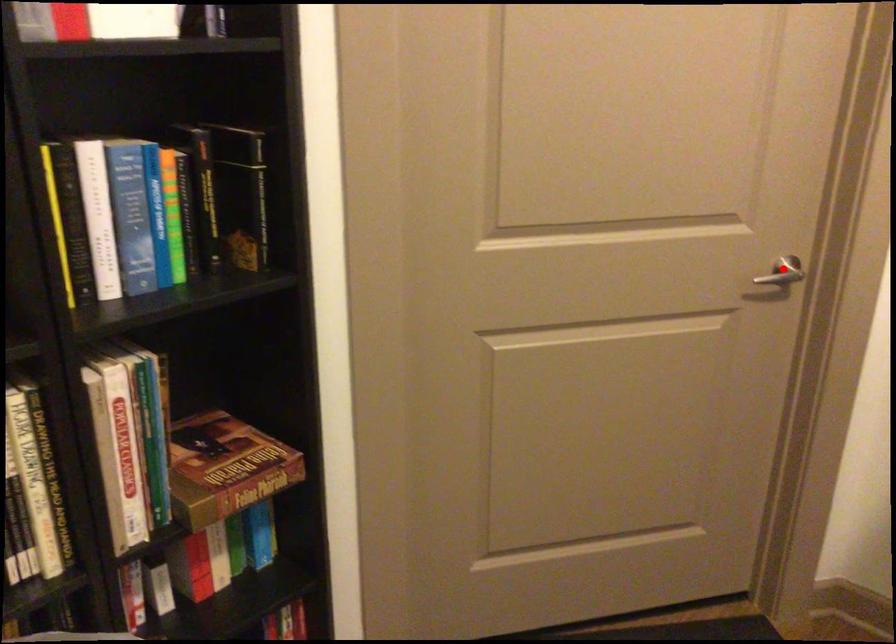
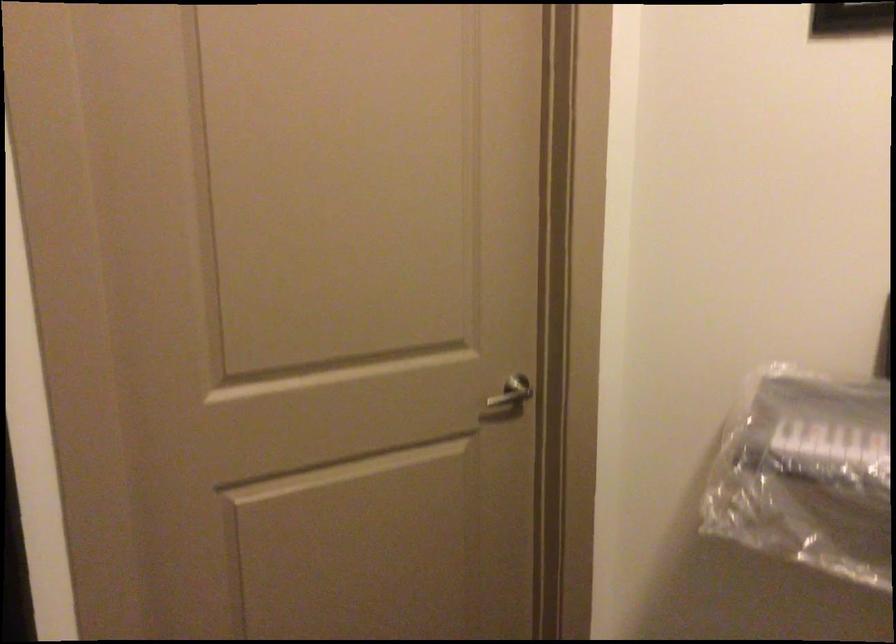
The point at the highlighted location is marked in the first image. Where is the corresponding point in the second image?

(512, 392)